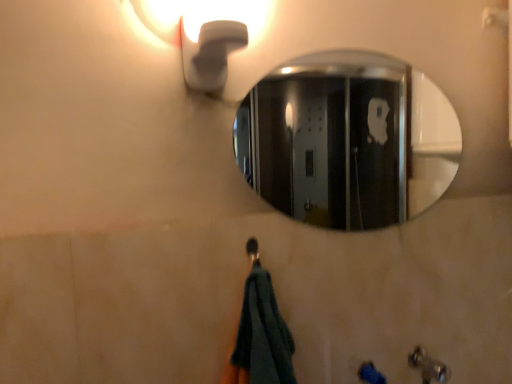
Question: Should I look upward or downward to see polished chrome mirror at upper center?

Choices:
 (A) down
 (B) up

Answer: (B)

Question: Is polished chrome mirror at upper center bigger than white matte light fixture at upper left?

Choices:
 (A) no
 (B) yes

Answer: (A)

Question: Considering the relative sizes of polished chrome mirror at upper center and white matte light fixture at upper left in the image provided, is polished chrome mirror at upper center taller than white matte light fixture at upper left?

Choices:
 (A) no
 (B) yes

Answer: (B)

Question: Is polished chrome mirror at upper center facing towards white matte light fixture at upper left?

Choices:
 (A) no
 (B) yes

Answer: (A)

Question: Is polished chrome mirror at upper center positioned far away from white matte light fixture at upper left?

Choices:
 (A) no
 (B) yes

Answer: (B)

Question: Does polished chrome mirror at upper center have a smaller size compared to white matte light fixture at upper left?

Choices:
 (A) yes
 (B) no

Answer: (A)

Question: Are polished chrome mirror at upper center and white matte light fixture at upper left making contact?

Choices:
 (A) no
 (B) yes

Answer: (A)

Question: Is metallic silver faucet at lower right located outside white matte light fixture at upper left?

Choices:
 (A) no
 (B) yes

Answer: (B)

Question: Is metallic silver faucet at lower right looking in the opposite direction of white matte light fixture at upper left?

Choices:
 (A) yes
 (B) no

Answer: (B)

Question: Does metallic silver faucet at lower right have a larger size compared to white matte light fixture at upper left?

Choices:
 (A) no
 (B) yes

Answer: (A)

Question: Does metallic silver faucet at lower right appear on the right side of white matte light fixture at upper left?

Choices:
 (A) yes
 (B) no

Answer: (A)

Question: From the image's perspective, is metallic silver faucet at lower right above white matte light fixture at upper left?

Choices:
 (A) no
 (B) yes

Answer: (A)

Question: Considering the relative sizes of metallic silver faucet at lower right and white matte light fixture at upper left in the image provided, is metallic silver faucet at lower right taller than white matte light fixture at upper left?

Choices:
 (A) yes
 (B) no

Answer: (B)

Question: Is metallic silver faucet at lower right wider than polished chrome mirror at upper center?

Choices:
 (A) no
 (B) yes

Answer: (B)